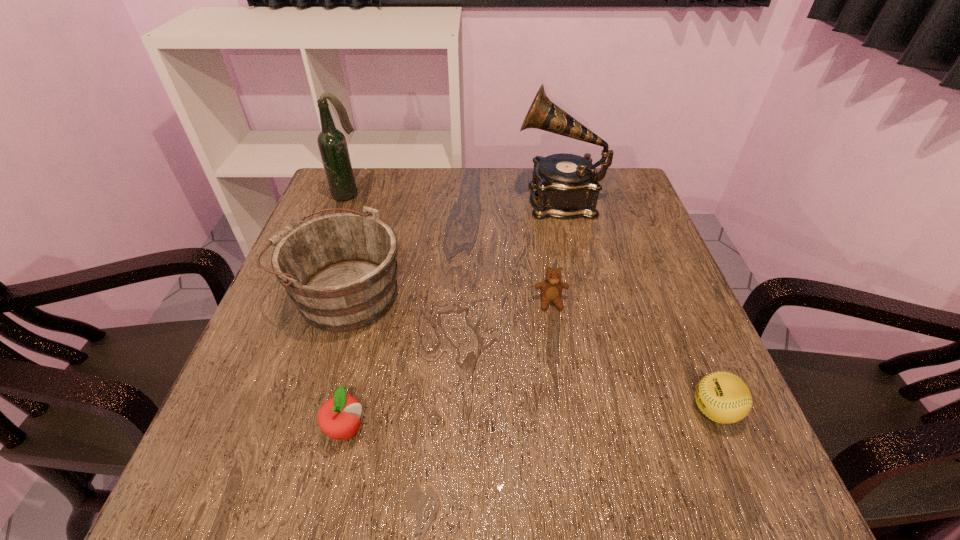
Locate an element on the screen. This screenshot has height=540, width=960. phonograph record is located at coordinates (564, 185).

Locate an element on the screen. beer bottle is located at coordinates [332, 143].

Where is `wine bucket`? This screenshot has width=960, height=540. wine bucket is located at coordinates (340, 269).

Where is `teddy bear`? The width and height of the screenshot is (960, 540). teddy bear is located at coordinates (551, 288).

The height and width of the screenshot is (540, 960). I want to click on apple, so click(x=339, y=417).

What are the coordinates of `the rightmost object` in the screenshot? It's located at (723, 397).

Identify the location of vacant position located on the horn of the phonograph record. The image size is (960, 540). (476, 199).

Where is `blank space located 0.180m on the horn of the phonograph record`? blank space located 0.180m on the horn of the phonograph record is located at coordinates (450, 199).

Find the location of a particular element. The height and width of the screenshot is (540, 960). free space located 0.360m on the horn of the phonograph record is located at coordinates (385, 199).

The height and width of the screenshot is (540, 960). Find the location of `vacant region located 0.100m on the right of the beer bottle`. vacant region located 0.100m on the right of the beer bottle is located at coordinates (400, 195).